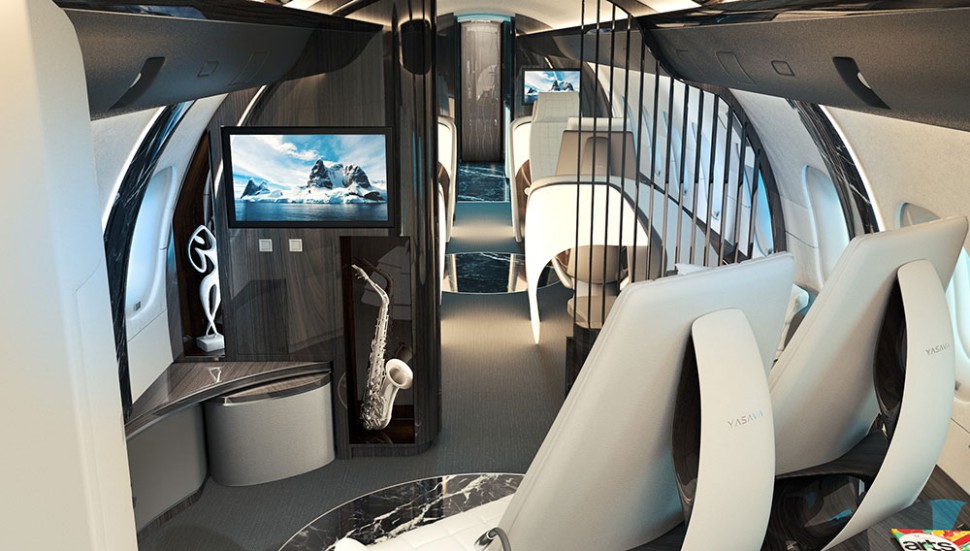
Find the location of a particular element. huge white computer screens is located at coordinates (674, 334), (889, 329).